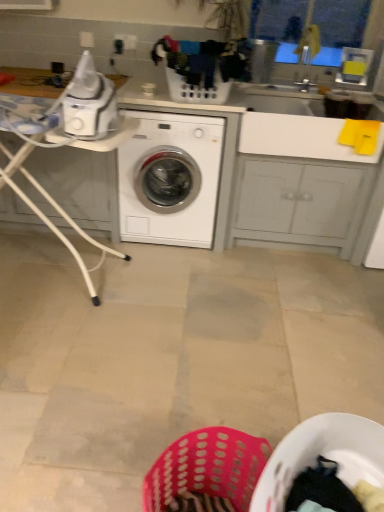
Question: Is white glossy washing machine at center oriented towards transparent plastic window screen at upper right?

Choices:
 (A) no
 (B) yes

Answer: (A)

Question: Is white glossy washing machine at center facing away from transparent plastic window screen at upper right?

Choices:
 (A) yes
 (B) no

Answer: (B)

Question: Is the depth of white glossy washing machine at center less than that of transparent plastic window screen at upper right?

Choices:
 (A) yes
 (B) no

Answer: (A)

Question: From a real-world perspective, is white glossy washing machine at center physically below transparent plastic window screen at upper right?

Choices:
 (A) no
 (B) yes

Answer: (B)

Question: Is white glossy washing machine at center not inside transparent plastic window screen at upper right?

Choices:
 (A) yes
 (B) no

Answer: (A)

Question: Is white plastic laundry basket at center taller or shorter than white glossy washing machine at center?

Choices:
 (A) tall
 (B) short

Answer: (B)

Question: Is white plastic laundry basket at center in front of or behind white glossy washing machine at center in the image?

Choices:
 (A) front
 (B) behind

Answer: (A)

Question: Visually, is white plastic laundry basket at center positioned to the left or to the right of white glossy washing machine at center?

Choices:
 (A) right
 (B) left

Answer: (A)

Question: Considering the positions of white plastic laundry basket at center and white glossy washing machine at center in the image, is white plastic laundry basket at center bigger or smaller than white glossy washing machine at center?

Choices:
 (A) big
 (B) small

Answer: (B)

Question: From a real-world perspective, is white plastic table at left above or below white glossy washing machine at center?

Choices:
 (A) below
 (B) above

Answer: (B)

Question: Based on their sizes in the image, would you say white plastic table at left is bigger or smaller than white glossy washing machine at center?

Choices:
 (A) small
 (B) big

Answer: (B)

Question: Looking at their shapes, would you say white plastic table at left is wider or thinner than white glossy washing machine at center?

Choices:
 (A) wide
 (B) thin

Answer: (B)

Question: Is white plastic table at left inside the boundaries of white glossy washing machine at center, or outside?

Choices:
 (A) outside
 (B) inside

Answer: (A)

Question: From a real-world perspective, is transparent plastic window screen at upper right above or below white glossy counter top at upper left?

Choices:
 (A) above
 (B) below

Answer: (A)

Question: From the image's perspective, is transparent plastic window screen at upper right positioned above or below white glossy counter top at upper left?

Choices:
 (A) below
 (B) above

Answer: (B)